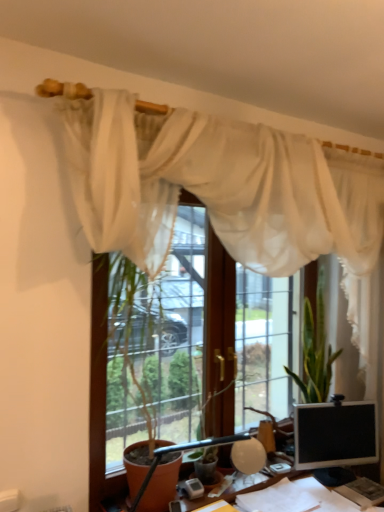
The image size is (384, 512). What are the coordinates of `matte black table lamp at center` in the screenshot? It's located at (210, 447).

What do you see at coordinates (210, 447) in the screenshot? I see `matte black table lamp at center` at bounding box center [210, 447].

This screenshot has height=512, width=384. I want to click on green leafy plant at center, so click(x=315, y=350).

In the scene shown: What is the approximate height of matte black monitor at lower right?

matte black monitor at lower right is 15.85 inches tall.

The image size is (384, 512). What do you see at coordinates (335, 434) in the screenshot?
I see `matte black monitor at lower right` at bounding box center [335, 434].

The image size is (384, 512). What do you see at coordinates (250, 488) in the screenshot?
I see `wooden desk at lower center` at bounding box center [250, 488].

Identify the location of sheer white curtain at upper center. Image resolution: width=384 pixels, height=512 pixels. (223, 190).

In the image, is matte black table lamp at center on the left side or the right side of green leafy plant at center?

Based on their positions, matte black table lamp at center is located to the left of green leafy plant at center.

From the picture: Who is shorter, matte black table lamp at center or green leafy plant at center?

matte black table lamp at center is shorter.

Which of these two, matte black table lamp at center or green leafy plant at center, is thinner?

matte black table lamp at center.

Can you tell me how much transparent glass window at center and matte black monitor at lower right differ in facing direction?

26.5 degrees.

Considering the relative positions of transparent glass window at center and matte black monitor at lower right in the image provided, is transparent glass window at center to the left of matte black monitor at lower right from the viewer's perspective?

Yes.

Is transparent glass window at center next to matte black monitor at lower right and touching it?

transparent glass window at center is not next to matte black monitor at lower right, and they're not touching.

Is matte black monitor at lower right inside transparent glass window at center?

Definitely not — matte black monitor at lower right is not inside transparent glass window at center.

Which is nearer, (230, 267) or (240, 461)?

Positioned in front is point (240, 461).

Considering the relative positions of transparent glass window at center and matte black table lamp at center in the image provided, is transparent glass window at center to the left of matte black table lamp at center from the viewer's perspective?

Correct, you'll find transparent glass window at center to the left of matte black table lamp at center.

Is matte black table lamp at center at the back of transparent glass window at center?

Absolutely, transparent glass window at center is directed away from matte black table lamp at center.

From a real-world perspective, is transparent glass window at center on matte black table lamp at center?

Yes, from a real-world perspective, transparent glass window at center is over matte black table lamp at center

This screenshot has width=384, height=512. In the image, there is a matte black monitor at lower right. What are the coordinates of `table lamp above it (from the image's perspective)` in the screenshot? It's located at (210, 447).

Is matte black table lamp at center to the left or to the right of matte black monitor at lower right in the image?

In the image, matte black table lamp at center appears on the left side of matte black monitor at lower right.

Can you tell me how much matte black table lamp at center and matte black monitor at lower right differ in facing direction?

1.64 degrees.

From the image's perspective, is matte black table lamp at center above or below matte black monitor at lower right?

Based on their image positions, matte black table lamp at center is located above matte black monitor at lower right.

From the image's perspective, between sheer white curtain at upper center and matte black monitor at lower right, who is located below?

matte black monitor at lower right, from the image's perspective.

Considering the relative sizes of sheer white curtain at upper center and matte black monitor at lower right in the image provided, is sheer white curtain at upper center shorter than matte black monitor at lower right?

No, sheer white curtain at upper center is not shorter than matte black monitor at lower right.

Is there a large distance between sheer white curtain at upper center and matte black monitor at lower right?

No, sheer white curtain at upper center is not far away from matte black monitor at lower right.

Which object is closer to the camera taking this photo, sheer white curtain at upper center or matte black monitor at lower right?

sheer white curtain at upper center is in front.

Measure the distance from sheer white curtain at upper center to transparent glass window at center.

sheer white curtain at upper center and transparent glass window at center are 31.76 inches apart from each other.

This screenshot has height=512, width=384. In order to click on curtain in front of the transparent glass window at center in this screenshot , I will do `click(223, 190)`.

Considering the relative sizes of sheer white curtain at upper center and transparent glass window at center in the image provided, is sheer white curtain at upper center wider than transparent glass window at center?

In fact, sheer white curtain at upper center might be narrower than transparent glass window at center.

Is sheer white curtain at upper center oriented towards transparent glass window at center?

Yes, sheer white curtain at upper center is aimed at transparent glass window at center.

Considering the positions of point (299, 408) and point (263, 480), is point (299, 408) closer or farther from the camera than point (263, 480)?

Point (299, 408).

From the picture: Can you confirm if matte black monitor at lower right is bigger than wooden desk at lower center?

No.

Would you say wooden desk at lower center is part of matte black monitor at lower right's contents?

No, wooden desk at lower center is not inside matte black monitor at lower right.

Which of these two, matte black monitor at lower right or wooden desk at lower center, is thinner?

With smaller width is matte black monitor at lower right.

The height and width of the screenshot is (512, 384). I want to click on table lamp in front of the green leafy plant at center, so click(x=210, y=447).

What are the coordinates of `window lying above the matte black monitor at lower right (from the image's perspective)` in the screenshot? It's located at (99, 389).

Estimate the real-world distances between objects in this image. Which object is further from matte black monitor at lower right, wooden desk at lower center or sheer white curtain at upper center?

sheer white curtain at upper center.

Considering their positions, is green leafy plant at center positioned closer to matte black monitor at lower right than wooden desk at lower center?

wooden desk at lower center is closer to matte black monitor at lower right.

Considering their positions, is wooden desk at lower center positioned closer to matte black table lamp at center than sheer white curtain at upper center?

wooden desk at lower center is positioned closer to the anchor matte black table lamp at center.

In the scene shown: Based on their spatial positions, is sheer white curtain at upper center or wooden desk at lower center closer to matte black table lamp at center?

Among the two, wooden desk at lower center is located nearer to matte black table lamp at center.

Consider the image. Estimate the real-world distances between objects in this image. Which object is closer to sheer white curtain at upper center, green leafy plant at center or matte black monitor at lower right?

green leafy plant at center lies closer to sheer white curtain at upper center than the other object.

Which object lies nearer to the anchor point transparent glass window at center, wooden desk at lower center or matte black table lamp at center?

wooden desk at lower center is positioned closer to the anchor transparent glass window at center.

From the image, which object appears to be farther from green leafy plant at center, matte black table lamp at center or matte black monitor at lower right?

matte black table lamp at center is further to green leafy plant at center.

Which object lies nearer to the anchor point transparent glass window at center, matte black table lamp at center or matte black monitor at lower right?

matte black table lamp at center lies closer to transparent glass window at center than the other object.

Locate an element on the screen. This screenshot has width=384, height=512. table lamp between sheer white curtain at upper center and green leafy plant at center along the z-axis is located at coordinates (210, 447).

Locate an element on the screen. table lamp positioned between wooden desk at lower center and green leafy plant at center from near to far is located at coordinates (210, 447).

I want to click on window between sheer white curtain at upper center and green leafy plant at center in the front-back direction, so click(x=99, y=389).

Where is `table lamp located between transparent glass window at center and matte black monitor at lower right in the left-right direction`? Image resolution: width=384 pixels, height=512 pixels. table lamp located between transparent glass window at center and matte black monitor at lower right in the left-right direction is located at coordinates (210, 447).